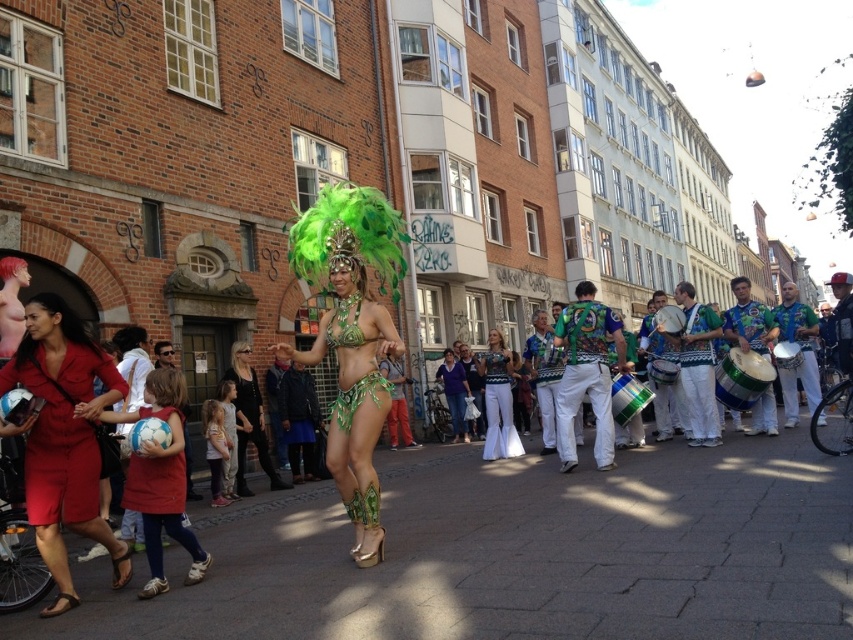
Question: Can you confirm if green leafy bikini at center is thinner than purple fabric dress at center?

Choices:
 (A) yes
 (B) no

Answer: (A)

Question: Is green fabric drum at center thinner than shiny silver drum at center?

Choices:
 (A) no
 (B) yes

Answer: (B)

Question: Which is farther from the green fabric drum at center?

Choices:
 (A) black leather jacket at center
 (B) blue and white checkered drum at center

Answer: (A)

Question: Does green metallic bikini at center appear over black leather jacket at center?

Choices:
 (A) yes
 (B) no

Answer: (A)

Question: Which point is farther to the camera?

Choices:
 (A) green metallic bikini at center
 (B) purple fabric dress at center
 (C) green fabric drum at center
 (D) shiny silver drum at center

Answer: (B)

Question: Which object is positioned closest to the blue and white checkered drum at center?

Choices:
 (A) black leather jacket at center
 (B) matte red dress at lower left
 (C) shiny silver drum at center
 (D) white textured pants at center

Answer: (D)